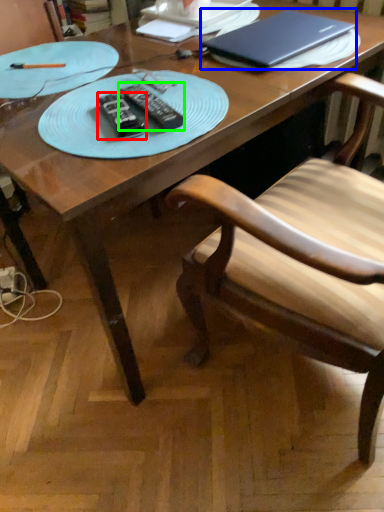
Question: Which object is the farthest from remote (highlighted by a red box)? Choose among these: laptop (highlighted by a blue box) or remote (highlighted by a green box).

Choices:
 (A) laptop
 (B) remote

Answer: (A)